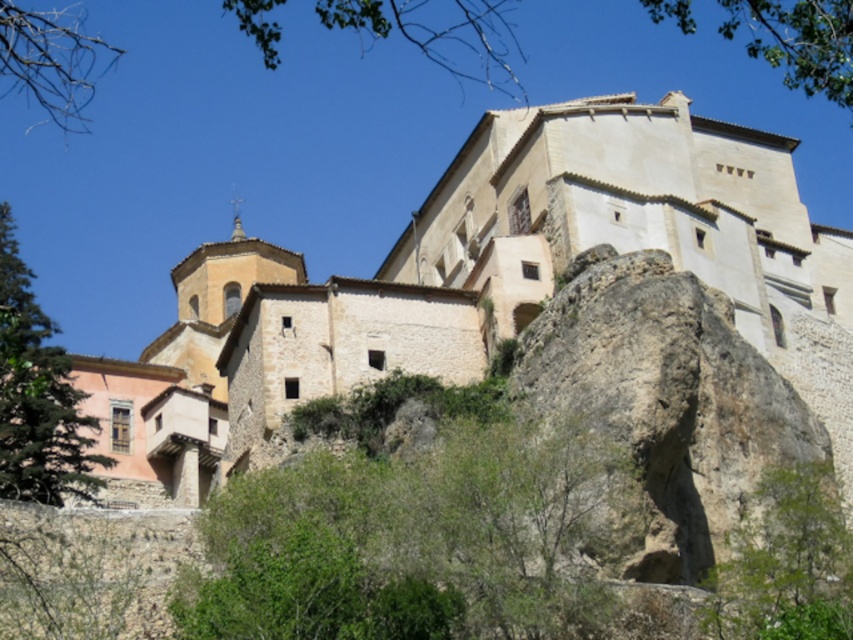
Question: Which point appears closest to the camera in this image?

Choices:
 (A) (602, 531)
 (B) (836, 483)

Answer: (A)

Question: Does green leafy tree at lower right appear over green leafy tree at lower left?

Choices:
 (A) yes
 (B) no

Answer: (B)

Question: Is green leafy tree at center smaller than green leafy tree at lower right?

Choices:
 (A) no
 (B) yes

Answer: (A)

Question: Is green leafy tree at lower right above green leafy tree at lower left?

Choices:
 (A) no
 (B) yes

Answer: (A)

Question: Among these objects, which one is farthest from the camera?

Choices:
 (A) green leafy tree at lower right
 (B) green leafy tree at lower left
 (C) green leafy tree at center

Answer: (B)

Question: Which is farther from the green leafy tree at lower right?

Choices:
 (A) green leafy tree at center
 (B) green leafy tree at lower left

Answer: (B)